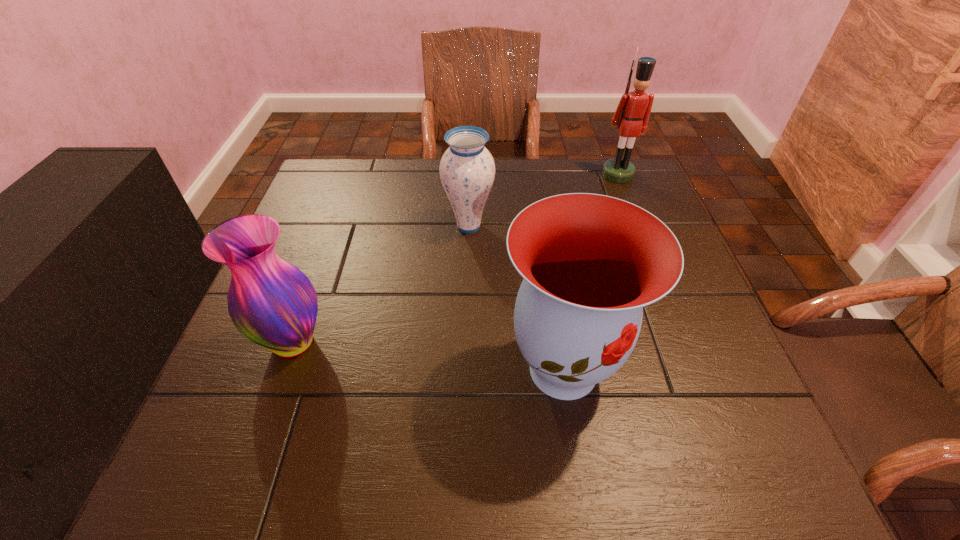
Identify the location of object that is the third closest to the farthest object. (271, 302).

Where is `the third closest object to the leftmost vase`? the third closest object to the leftmost vase is located at coordinates (632, 114).

Where is `the closest vase to the third nearest object`? the closest vase to the third nearest object is located at coordinates (589, 262).

Point out which vase is positioned as the second nearest to the nutcracker. Please provide its 2D coordinates. Your answer should be formatted as a tuple, i.e. [(x, y)], where the tuple contains the x and y coordinates of a point satisfying the conditions above.

[(589, 262)]

In order to click on vacant space that satisfies the following two spatial constraints: 1. on the front side of the rightmost vase; 2. on the right side of the leftmost object in this screenshot , I will do `click(283, 370)`.